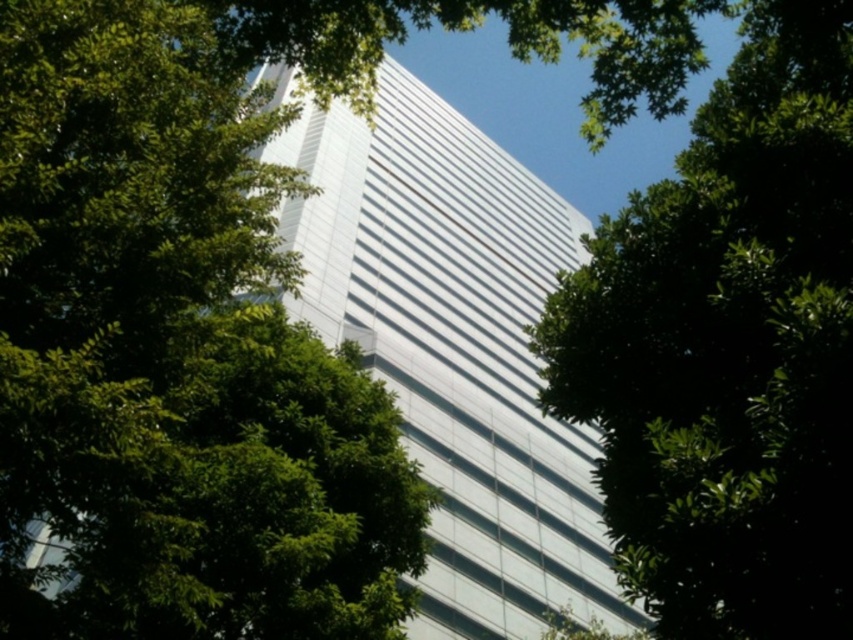
Measure the distance between green leafy tree at upper left and white glass building at center.

green leafy tree at upper left and white glass building at center are 13.58 meters apart.

Is green leafy tree at upper left smaller than white glass building at center?

Indeed, green leafy tree at upper left has a smaller size compared to white glass building at center.

In order to click on green leafy tree at upper left in this screenshot , I will do `click(173, 355)`.

Can you confirm if green leafy tree at upper left is bigger than green leafy tree at center?

Correct, green leafy tree at upper left is larger in size than green leafy tree at center.

From the picture: Does green leafy tree at upper left have a greater height compared to green leafy tree at center?

Yes, green leafy tree at upper left is taller than green leafy tree at center.

You are a GUI agent. You are given a task and a screenshot of the screen. Output one action in this format:
    pyautogui.click(x=<x>, y=<y>)
    Task: Click on the green leafy tree at upper left
    
    Given the screenshot: What is the action you would take?
    pyautogui.click(x=173, y=355)

In the scene shown: Can you confirm if green leafy tree at center is wider than white glass building at center?

In fact, green leafy tree at center might be narrower than white glass building at center.

Measure the distance from green leafy tree at center to white glass building at center.

green leafy tree at center and white glass building at center are 36.23 meters apart from each other.

The image size is (853, 640). In order to click on green leafy tree at center in this screenshot , I will do `click(729, 348)`.